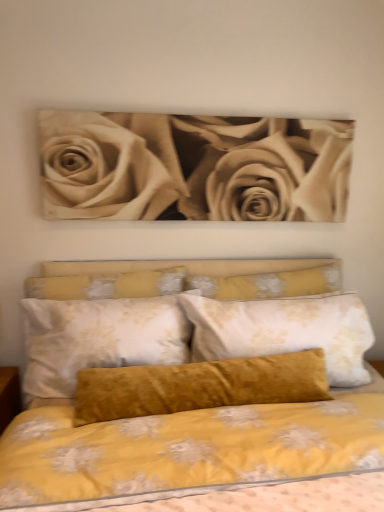
Question: From the image's perspective, relative to sepia-toned roses at upper center, is velvet mustard pillow at center above or below?

Choices:
 (A) below
 (B) above

Answer: (A)

Question: Relative to sepia-toned roses at upper center, is velvet mustard pillow at center in front or behind?

Choices:
 (A) behind
 (B) front

Answer: (B)

Question: Which object is positioned closest to the velvet mustard pillow at center?

Choices:
 (A) velvet yellow pillow at center
 (B) sepia-toned roses at upper center

Answer: (A)

Question: Which of these objects is positioned closest to the velvet yellow pillow at center?

Choices:
 (A) velvet mustard pillow at center
 (B) sepia-toned roses at upper center

Answer: (B)